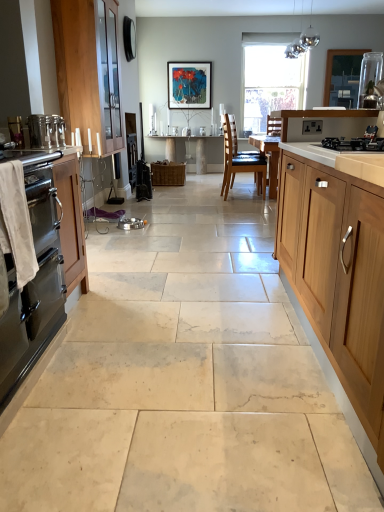
Question: In terms of size, does glossy metallic light fixture at upper center appear bigger or smaller than metallic stainless steel oven at left, the 2th appliance in the front-to-back sequence?

Choices:
 (A) small
 (B) big

Answer: (B)

Question: Is point (311, 38) closer or farther from the camera than point (8, 117)?

Choices:
 (A) closer
 (B) farther

Answer: (B)

Question: Estimate the real-world distances between objects in this image. Which object is farther from the clear glass jar at upper right?

Choices:
 (A) light brown wood chair at center
 (B) white marble table at center
 (C) wooden cabinet at left, acting as the third cabinetry starting from the right
 (D) black matte gas stove at upper right
 (E) wooden cabinet at right, the third cabinetry from the back

Answer: (E)

Question: Based on their relative distances, which object is nearer to the clear glass vase at upper right, which is counted as the 1th appliance, starting from the right?

Choices:
 (A) white marble table at center
 (B) satin silver countertop at left
 (C) black matte gas stove at upper right
 (D) transparent glass window at center
 (E) wooden cabinet at left, marked as the third cabinetry in a front-to-back arrangement

Answer: (D)